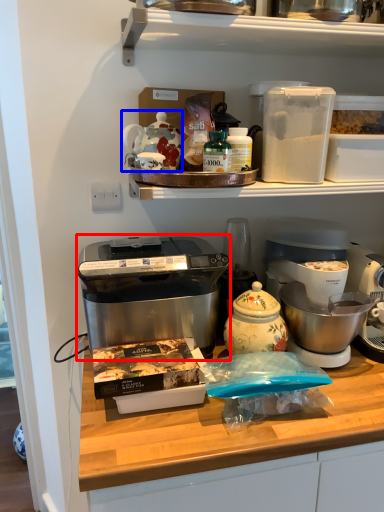
Question: Among these objects, which one is farthest to the camera, home appliance (highlighted by a red box) or appliance (highlighted by a blue box)?

Choices:
 (A) home appliance
 (B) appliance

Answer: (B)